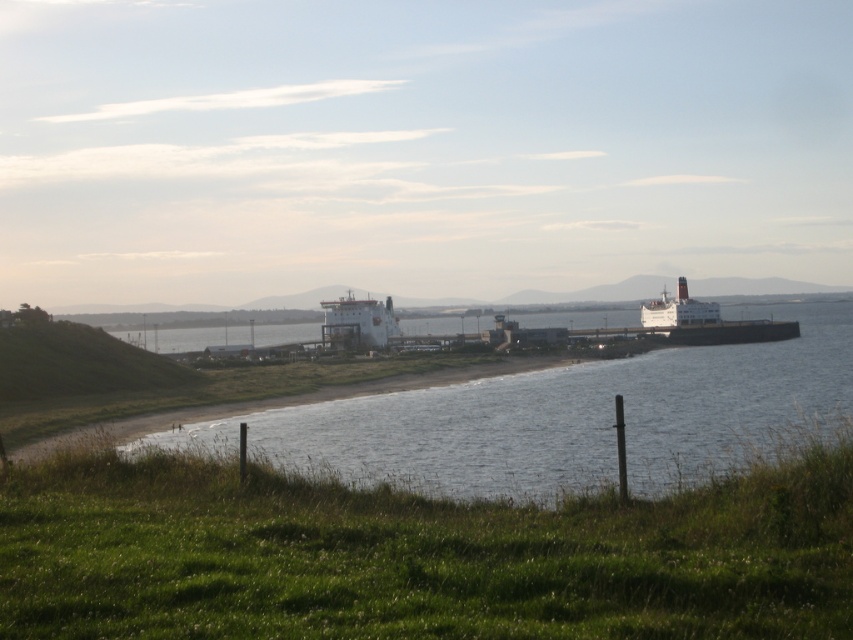
Question: Among these points, which one is nearest to the camera?

Choices:
 (A) (445, 433)
 (B) (397, 317)
 (C) (647, 310)

Answer: (A)

Question: Which of the following is the closest to the observer?

Choices:
 (A) (643, 412)
 (B) (682, 291)
 (C) (384, 317)
 (D) (790, 548)

Answer: (D)

Question: Is green grassy at lower left positioned in front of white matte ship at center?

Choices:
 (A) no
 (B) yes

Answer: (B)

Question: Can you confirm if clear water at center is positioned above white matte ship at center?

Choices:
 (A) yes
 (B) no

Answer: (B)

Question: Based on their relative distances, which object is farther from the clear water at center?

Choices:
 (A) white matte ferry at upper right
 (B) white matte ship at center

Answer: (B)

Question: Does green grassy at lower left have a greater width compared to white matte ship at center?

Choices:
 (A) no
 (B) yes

Answer: (B)